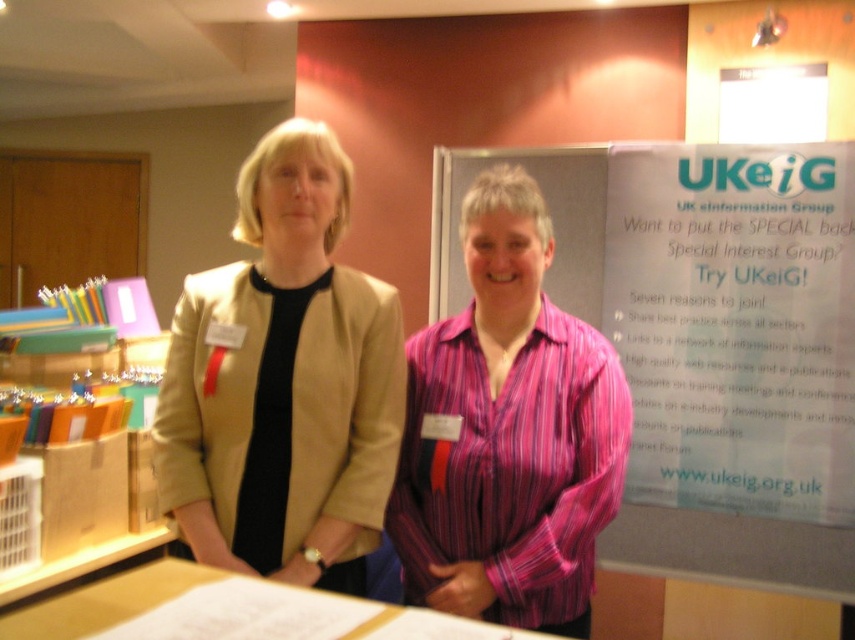
Which is above, white paperboard at center or pink striped shirt at center?

white paperboard at center

Is the position of white paperboard at center less distant than that of pink striped shirt at center?

No.

Is point (587, 234) positioned before point (447, 358)?

No, it is behind (447, 358).

This screenshot has height=640, width=855. Identify the location of white paperboard at center. (706, 342).

Which of these two, beige fabric jacket at center or pink striped shirt at center, stands shorter?

beige fabric jacket at center

This screenshot has width=855, height=640. Describe the element at coordinates (282, 381) in the screenshot. I see `beige fabric jacket at center` at that location.

The height and width of the screenshot is (640, 855). I want to click on beige fabric jacket at center, so [x=282, y=381].

Is white paperboard at center taller than white paper at upper right?

Yes.

Is white paperboard at center below white paper at upper right?

No, white paperboard at center is not below white paper at upper right.

Who is more distant from viewer, (528, 160) or (749, 330)?

The point (528, 160) is more distant.

Find the location of `white paperboard at center`. white paperboard at center is located at coordinates (706, 342).